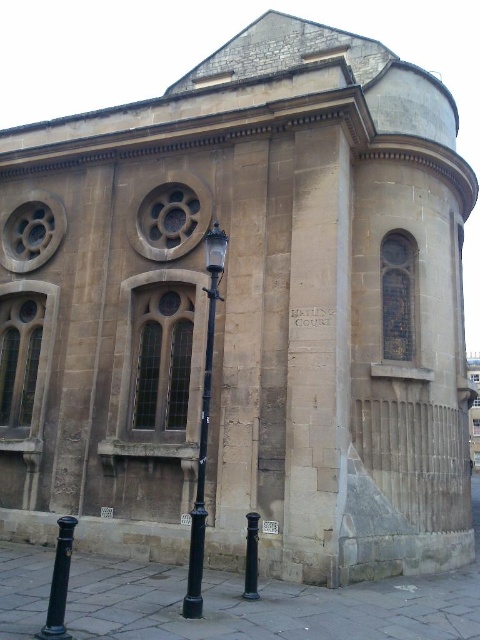
Does black metal pole at lower left have a smaller size compared to green metallic pole at lower center?

No.

Who is more distant from viewer, (62, 566) or (257, 522)?

Positioned behind is point (257, 522).

Locate an element on the screen. The width and height of the screenshot is (480, 640). black metal pole at lower left is located at coordinates (59, 582).

Describe the element at coordinates (204, 426) in the screenshot. I see `black metal streetlight at center` at that location.

Can you confirm if black metal streetlight at center is thinner than green metallic pole at lower center?

Incorrect, black metal streetlight at center's width is not less than green metallic pole at lower center's.

This screenshot has width=480, height=640. I want to click on black metal streetlight at center, so click(x=204, y=426).

Does black metal streetlight at center have a smaller size compared to black metal pole at lower left?

No.

Based on the photo, who is positioned more to the left, black metal streetlight at center or black metal pole at lower left?

From the viewer's perspective, black metal pole at lower left appears more on the left side.

Who is more forward, (206, 291) or (60, 595)?

Point (60, 595) is more forward.

Image resolution: width=480 pixels, height=640 pixels. What are the coordinates of `black metal streetlight at center` in the screenshot? It's located at (204, 426).